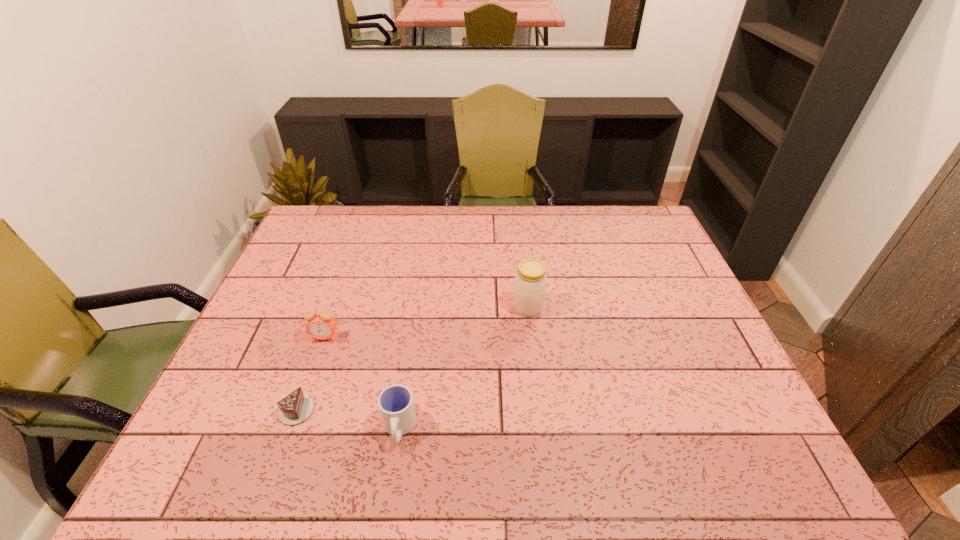
You are a GUI agent. You are given a task and a screenshot of the screen. Output one action in this format:
    pyautogui.click(x=<x>, y=<y>)
    Task: Click on the object positioned at the near edge
    The width and height of the screenshot is (960, 540).
    Given the screenshot: What is the action you would take?
    pyautogui.click(x=396, y=405)

The image size is (960, 540). I want to click on object that is at the left edge, so click(x=296, y=407).

Locate an element on the screen. This screenshot has height=540, width=960. vacant region at the far edge of the desktop is located at coordinates 551,242.

The height and width of the screenshot is (540, 960). I want to click on free spot at the left edge of the desktop, so click(x=282, y=375).

Image resolution: width=960 pixels, height=540 pixels. In order to click on vacant region at the right edge in this screenshot , I will do `click(752, 436)`.

The width and height of the screenshot is (960, 540). In order to click on vacant space at the near left corner in this screenshot , I will do `click(207, 448)`.

Where is `free region at the far right corner`? Image resolution: width=960 pixels, height=540 pixels. free region at the far right corner is located at coordinates (620, 237).

Identify the location of free area in between the chocolate cake and the cup. The height and width of the screenshot is (540, 960). (347, 419).

At what (x,y) coordinates should I click in order to perform the action: click on empty space between the third tallest object and the farthest object. Please return your answer as a coordinate pair (x, y). The image size is (960, 540). Looking at the image, I should click on (464, 368).

At what (x,y) coordinates should I click in order to perform the action: click on empty space that is in between the shortest object and the third nearest object. Please return your answer as a coordinate pair (x, y). This screenshot has width=960, height=540. Looking at the image, I should click on (310, 374).